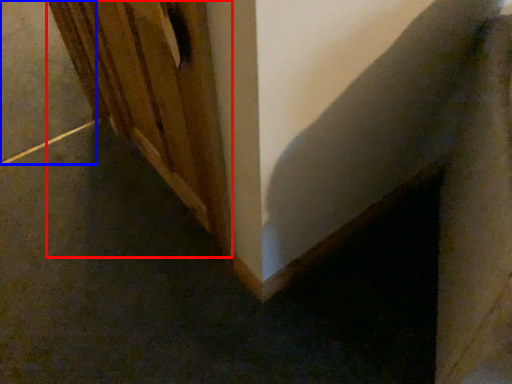
Question: Which of the following is the farthest to the observer, door (highlighted by a red box) or concrete (highlighted by a blue box)?

Choices:
 (A) door
 (B) concrete

Answer: (B)